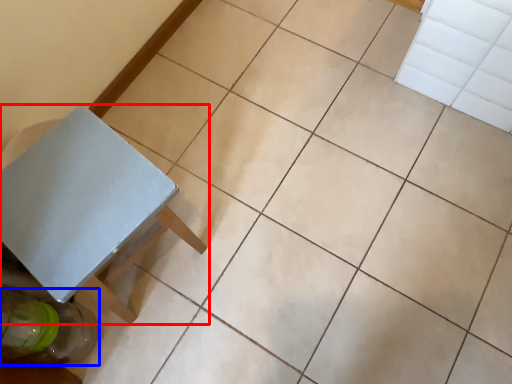
Question: Which point is closer to the camera, table (highlighted by a red box) or glass bottle (highlighted by a blue box)?

Choices:
 (A) table
 (B) glass bottle

Answer: (A)